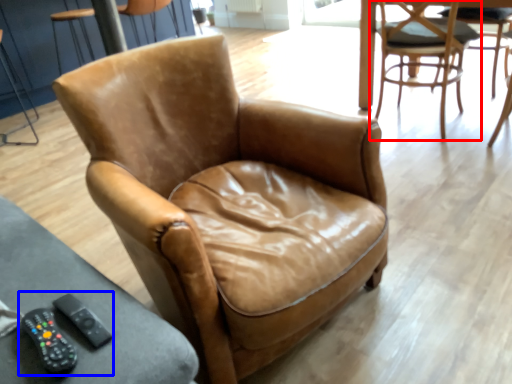
Question: Which point is further to the camera, chair (highlighted by a red box) or game controller (highlighted by a blue box)?

Choices:
 (A) chair
 (B) game controller

Answer: (A)